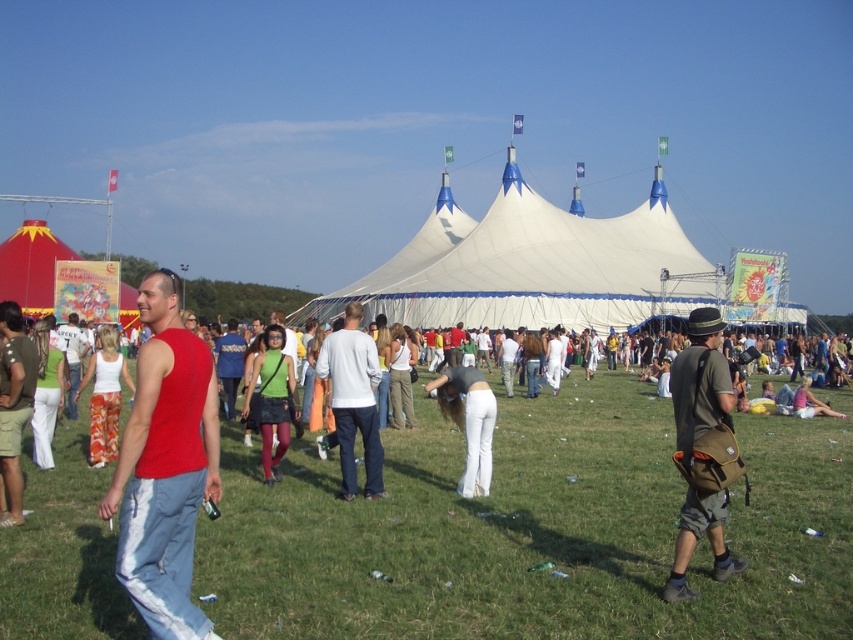
Which is more to the left, red fabric tent at left or white matte pants at center?

From the viewer's perspective, red fabric tent at left appears more on the left side.

Looking at this image, does red fabric tent at left have a lesser width compared to white matte pants at center?

No.

Locate an element on the screen. The image size is (853, 640). red fabric tent at left is located at coordinates (32, 266).

Does point (651, 472) come behind point (349, 368)?

Yes, it is behind point (349, 368).

Locate an element on the screen. The width and height of the screenshot is (853, 640). green grass at center is located at coordinates (532, 531).

Which of these two, green grass at center or green matte tank top at center, stands shorter?

Standing shorter between the two is green grass at center.

Is green grass at center bigger than green matte tank top at center?

Yes, green grass at center is bigger than green matte tank top at center.

Is point (479, 556) positioned behind point (276, 326)?

No, (479, 556) is closer to viewer.

Find the location of `green grass at center`. green grass at center is located at coordinates (x=532, y=531).